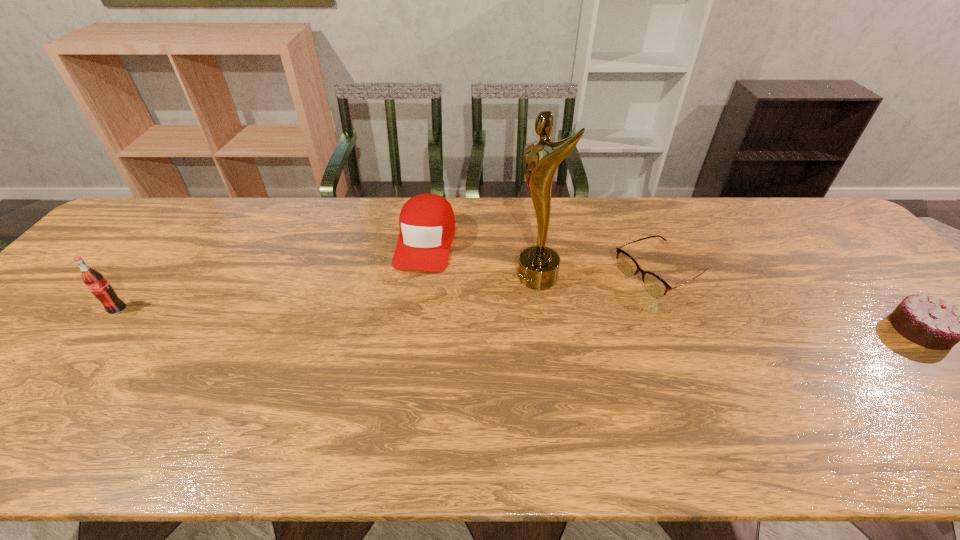
Image resolution: width=960 pixels, height=540 pixels. I want to click on free location located on the front-facing side of the second object from left to right, so click(397, 346).

The width and height of the screenshot is (960, 540). I want to click on free space located on the front-facing side of the second object from left to right, so click(415, 287).

Image resolution: width=960 pixels, height=540 pixels. Identify the location of free space located on the face of the fourth object from left to right. (520, 345).

At what (x,y) coordinates should I click in order to perform the action: click on vacant space situated on the face of the fourth object from left to right. Please return your answer as a coordinate pair (x, y). Looking at the image, I should click on (510, 350).

You are a GUI agent. You are given a task and a screenshot of the screen. Output one action in this format:
    pyautogui.click(x=<x>, y=<y>)
    Task: Click on the free space located on the face of the fourth object from left to right
    Image resolution: width=960 pixels, height=540 pixels.
    Given the screenshot: What is the action you would take?
    pyautogui.click(x=573, y=318)

At what (x,y) coordinates should I click in order to perform the action: click on vacant point located 0.300m on the front-facing side of the tallest object. Please return your answer as a coordinate pair (x, y). Image resolution: width=960 pixels, height=540 pixels. Looking at the image, I should click on (420, 333).

This screenshot has width=960, height=540. Identify the location of blank area located 0.050m on the front-facing side of the tallest object. (505, 294).

You are a GUI agent. You are given a task and a screenshot of the screen. Output one action in this format:
    pyautogui.click(x=<x>, y=<y>)
    Task: Click on the vacant space located on the front-facing side of the tallest object
    The image size is (960, 540).
    Given the screenshot: What is the action you would take?
    pyautogui.click(x=501, y=295)

I want to click on object located at the far edge, so click(x=427, y=224).

Where is `free space at the far edge`? free space at the far edge is located at coordinates (587, 204).